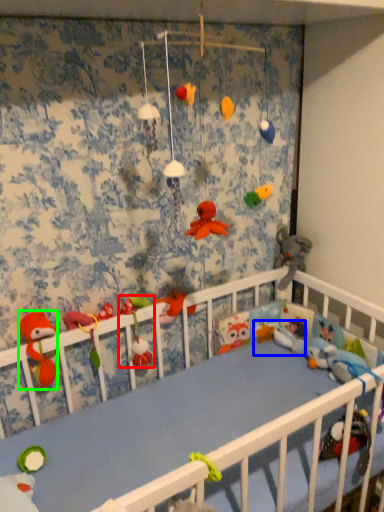
Question: Which object is positioned closest to toy (highlighted by a red box)? Select from toy (highlighted by a blue box) and toy (highlighted by a green box).

Choices:
 (A) toy
 (B) toy

Answer: (B)